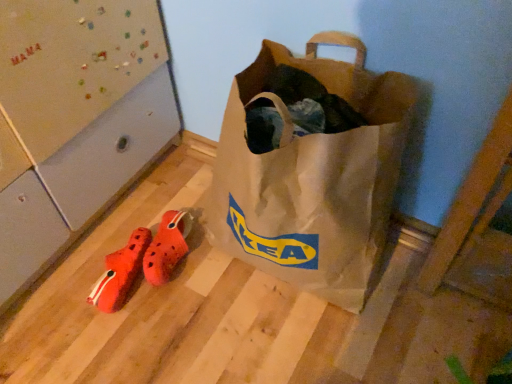
The image size is (512, 384). Find the location of `blank space to the left of matte brown paper bag at center`. blank space to the left of matte brown paper bag at center is located at coordinates (141, 280).